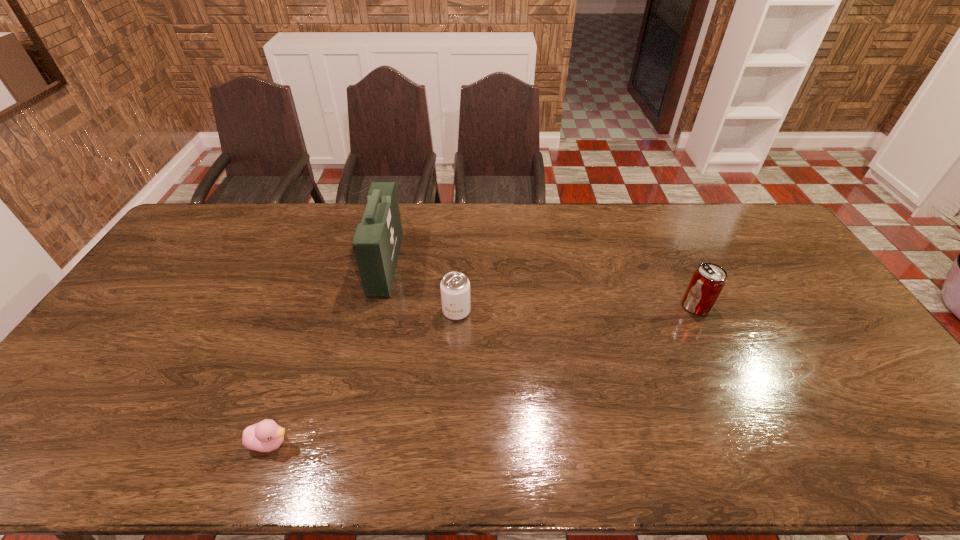
The image size is (960, 540). I want to click on vacant space that satisfies the following two spatial constraints: 1. on the front-facing side of the second object from right to left; 2. on the right side of the second object from left to right, so click(374, 311).

Image resolution: width=960 pixels, height=540 pixels. Find the location of `free point that satisfies the following two spatial constraints: 1. on the front side of the right soda can; 2. on the front-facing side of the nearest object`. free point that satisfies the following two spatial constraints: 1. on the front side of the right soda can; 2. on the front-facing side of the nearest object is located at coordinates (760, 443).

The width and height of the screenshot is (960, 540). Identify the location of free location that satisfies the following two spatial constraints: 1. on the back side of the left soda can; 2. on the front-facing side of the third object from right to left. (459, 264).

Find the location of `vacant area in the image that satisfies the following two spatial constraints: 1. on the front-facing side of the third object from right to left; 2. on the left side of the left soda can`. vacant area in the image that satisfies the following two spatial constraints: 1. on the front-facing side of the third object from right to left; 2. on the left side of the left soda can is located at coordinates (374, 311).

At what (x,y) coordinates should I click in order to perform the action: click on vacant space that satisfies the following two spatial constraints: 1. on the front-facing side of the second object from left to right; 2. on the right side of the right soda can. Please return your answer as a coordinate pair (x, y). The image size is (960, 540). Looking at the image, I should click on (376, 306).